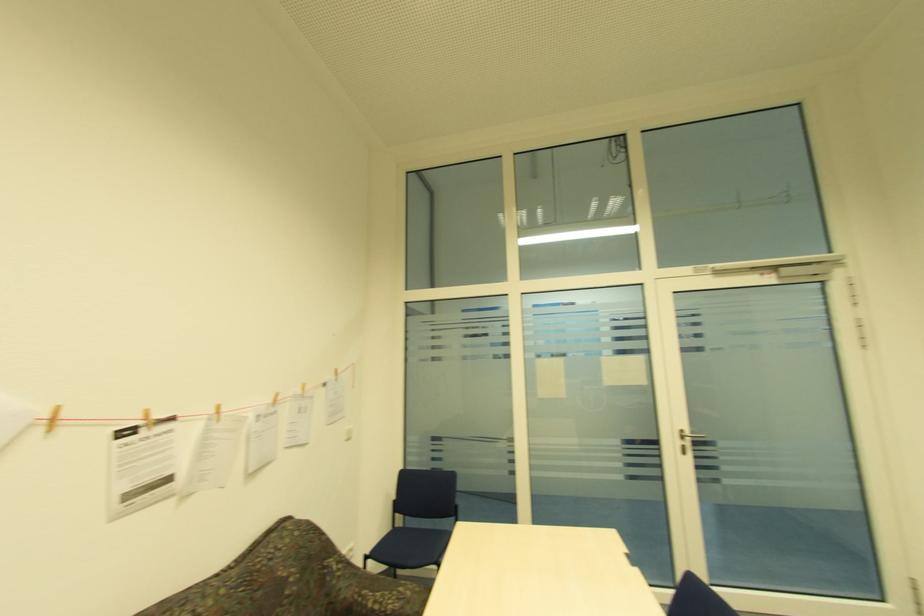
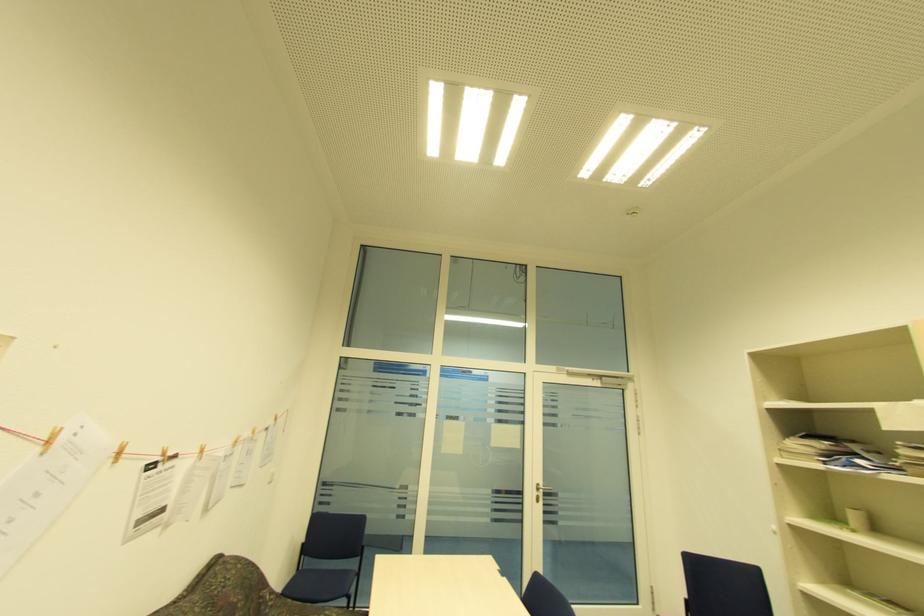
What movement of the cameraman would produce the second image?

The movement direction of the cameraman is left, backward.